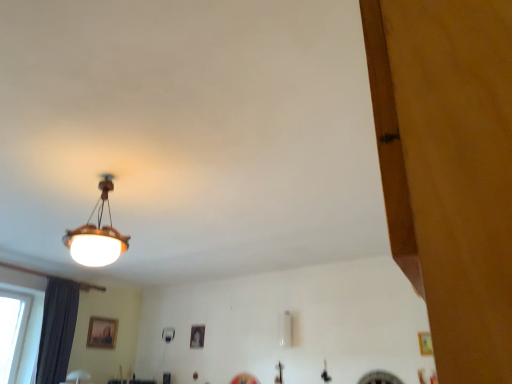
Question: Is dark gray fabric curtain at left to the left of matte black picture frame at center, which appears as the 1th picture frame when viewed from the right, from the viewer's perspective?

Choices:
 (A) yes
 (B) no

Answer: (A)

Question: Is dark gray fabric curtain at left taller than matte black picture frame at center, the 2th picture frame in the left-to-right sequence?

Choices:
 (A) no
 (B) yes

Answer: (B)

Question: Considering the relative sizes of dark gray fabric curtain at left and matte black picture frame at center, which appears as the 1th picture frame when viewed from the right, in the image provided, is dark gray fabric curtain at left smaller than matte black picture frame at center, which appears as the 1th picture frame when viewed from the right,?

Choices:
 (A) yes
 (B) no

Answer: (B)

Question: Considering the relative sizes of dark gray fabric curtain at left and matte black picture frame at center, which appears as the 1th picture frame when viewed from the right, in the image provided, is dark gray fabric curtain at left thinner than matte black picture frame at center, which appears as the 1th picture frame when viewed from the right,?

Choices:
 (A) no
 (B) yes

Answer: (A)

Question: Considering the relative sizes of dark gray fabric curtain at left and matte black picture frame at center, the 2th picture frame in the left-to-right sequence, in the image provided, is dark gray fabric curtain at left wider than matte black picture frame at center, the 2th picture frame in the left-to-right sequence,?

Choices:
 (A) yes
 (B) no

Answer: (A)

Question: Would you say dark gray fabric curtain at left is a long distance from matte black picture frame at center, the 2th picture frame in the left-to-right sequence?

Choices:
 (A) no
 (B) yes

Answer: (B)

Question: Can you confirm if matte black picture frame at center, the 2th picture frame in the left-to-right sequence, is taller than matte wooden lampshade at upper left?

Choices:
 (A) no
 (B) yes

Answer: (A)

Question: Is matte black picture frame at center, which appears as the 1th picture frame when viewed from the right, smaller than matte wooden lampshade at upper left?

Choices:
 (A) no
 (B) yes

Answer: (B)

Question: Is matte black picture frame at center, the 2th picture frame in the left-to-right sequence, not near matte wooden lampshade at upper left?

Choices:
 (A) no
 (B) yes

Answer: (B)

Question: Is the position of matte black picture frame at center, the 2th picture frame in the left-to-right sequence, more distant than that of matte wooden lampshade at upper left?

Choices:
 (A) no
 (B) yes

Answer: (B)

Question: From a real-world perspective, is matte black picture frame at center, which appears as the 1th picture frame when viewed from the right, located higher than matte wooden lampshade at upper left?

Choices:
 (A) no
 (B) yes

Answer: (A)

Question: Can you confirm if matte black picture frame at center, the 2th picture frame in the left-to-right sequence, is bigger than matte wooden lampshade at upper left?

Choices:
 (A) yes
 (B) no

Answer: (B)

Question: Could you tell me if wooden picture frame at lower center, which is the first picture frame in left-to-right order, is turned towards matte black picture frame at center, the 2th picture frame in the left-to-right sequence?

Choices:
 (A) yes
 (B) no

Answer: (A)